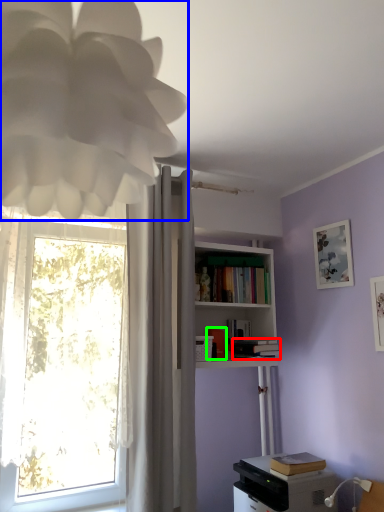
Question: Based on their relative distances, which object is nearer to book (highlighted by a red box)? Choose from lamp (highlighted by a blue box) and book (highlighted by a green box).

Choices:
 (A) lamp
 (B) book

Answer: (B)